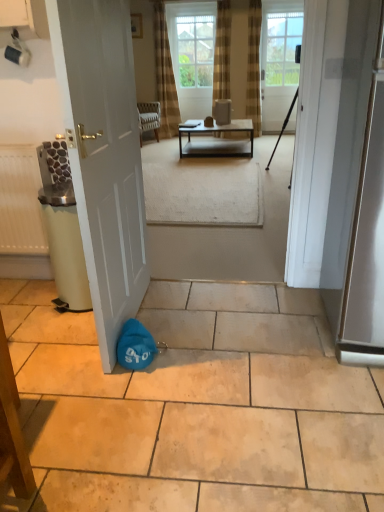
This screenshot has height=512, width=384. In order to click on free space in front of white matte door at left, which is counted as the second door, starting from the top in this screenshot , I will do `click(119, 392)`.